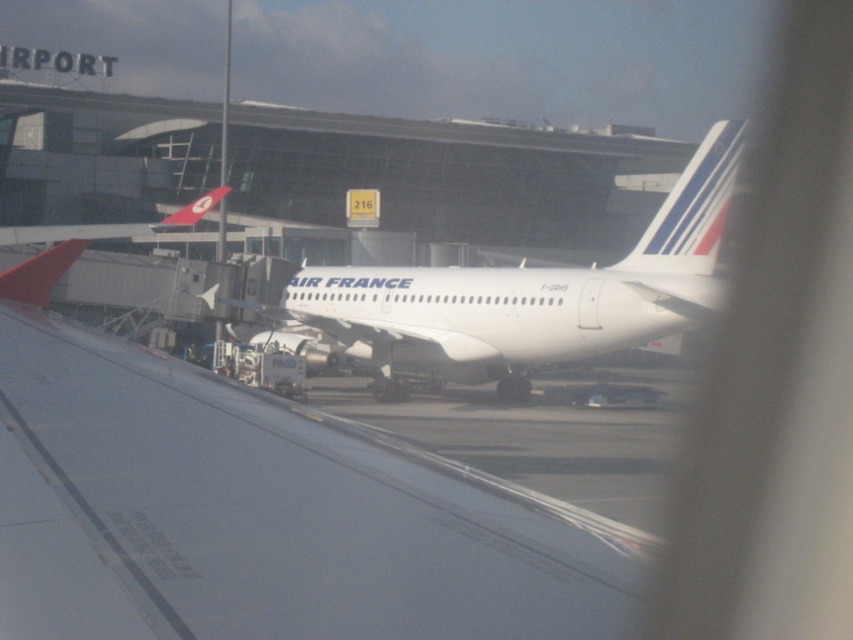
Question: Which object is the farthest from the white/smooth tail at center?

Choices:
 (A) white matte wing at center
 (B) white glossy airplane at center

Answer: (A)

Question: Is white matte wing at center positioned behind white glossy airplane at center?

Choices:
 (A) no
 (B) yes

Answer: (A)

Question: Estimate the real-world distances between objects in this image. Which object is closer to the white/smooth tail at center?

Choices:
 (A) white matte wing at center
 (B) white glossy airplane at center

Answer: (B)

Question: Among these objects, which one is nearest to the camera?

Choices:
 (A) white matte wing at center
 (B) white/smooth tail at center

Answer: (A)

Question: Can you confirm if white glossy airplane at center is positioned above white/smooth tail at center?

Choices:
 (A) no
 (B) yes

Answer: (A)

Question: Can you confirm if white matte wing at center is wider than white/smooth tail at center?

Choices:
 (A) yes
 (B) no

Answer: (A)